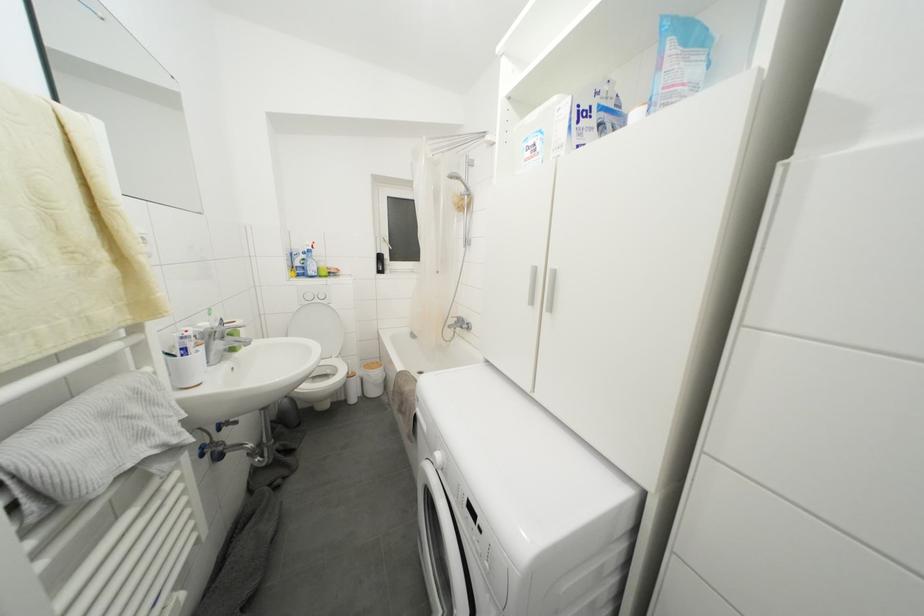
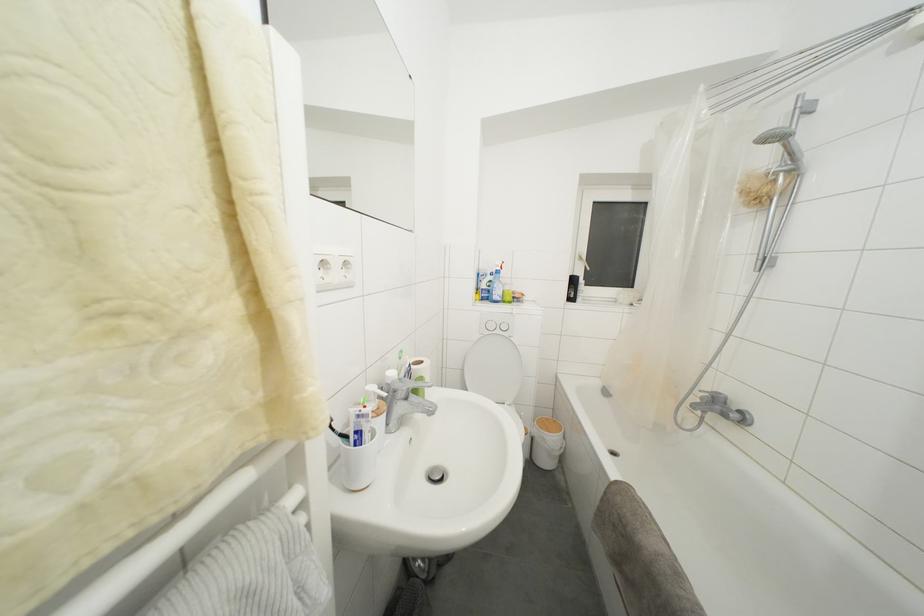
The point at (369, 383) is marked in the first image. Where is the corresponding point in the second image?

(541, 445)